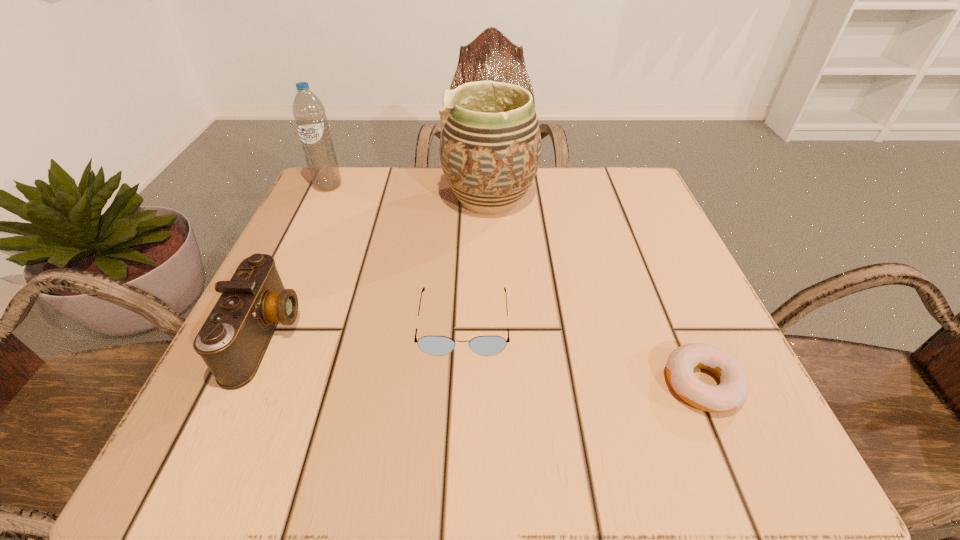
Find the location of `blank space that satisfies the following two spatial constraints: 1. on the lens of the shortest object; 2. on the left side of the camera`. blank space that satisfies the following two spatial constraints: 1. on the lens of the shortest object; 2. on the left side of the camera is located at coordinates (244, 384).